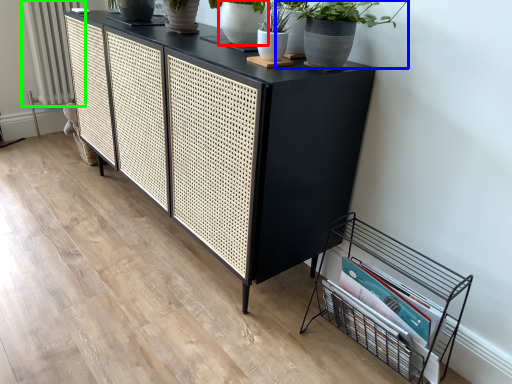
Question: Which object is the closest to the flowerpot (highlighted by a red box)? Choose among these: houseplant (highlighted by a blue box) or radiator (highlighted by a green box).

Choices:
 (A) houseplant
 (B) radiator

Answer: (A)